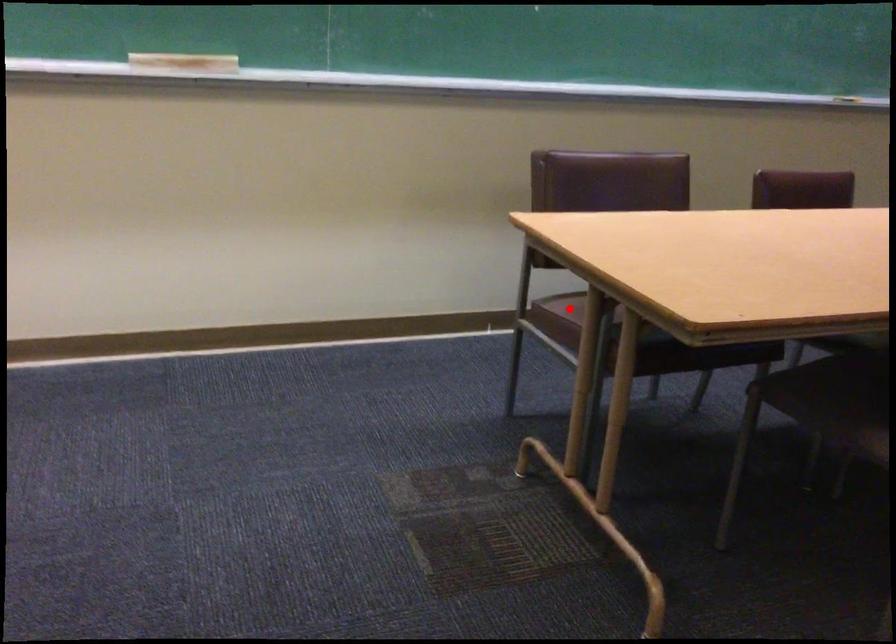
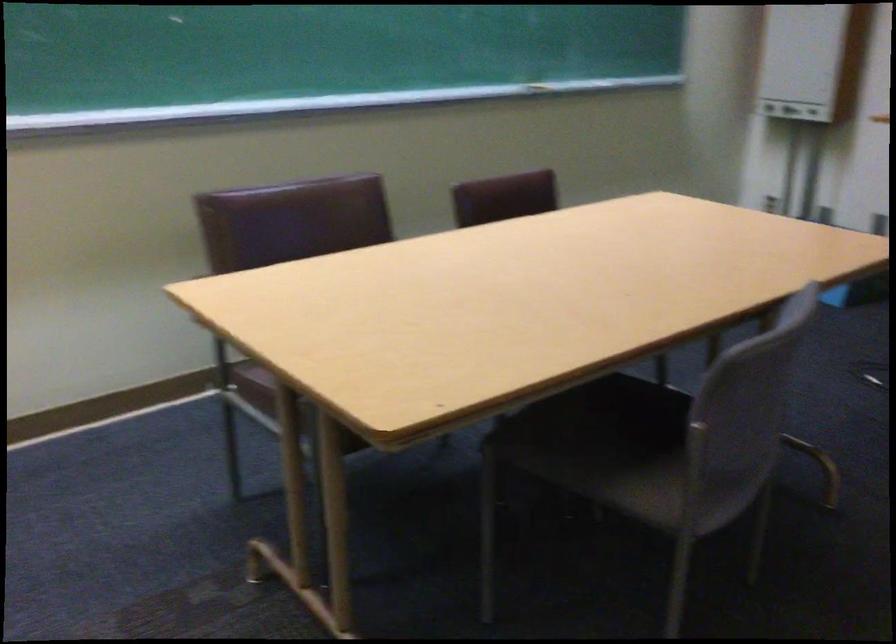
Where in the second image is the point corresponding to the highlighted location from the first image?

(277, 375)